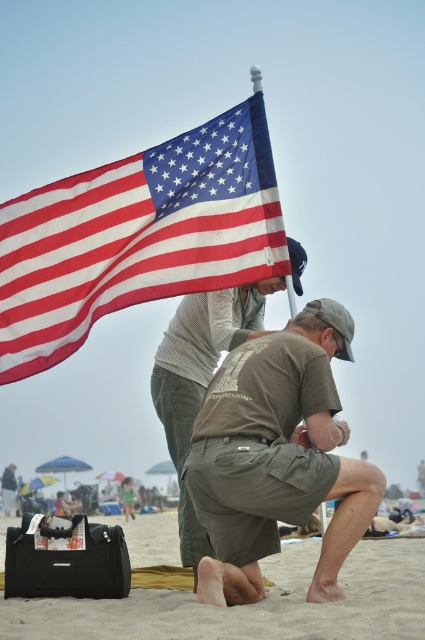
Based on the scene described, which object is shorter in height between the american flag at upper left and the sandy beige sand at lower center?

The american flag at upper left is shorter in height compared to the sandy beige sand at lower center according to the description.

You are standing at the beach and want to place a small flag on the point that is closer to you. Which point should you choose between point (223, 472) and point (167, 337)?

Point (223, 472) is closer to the camera than point (167, 337), so you should choose point (223, 472) to place the small flag.